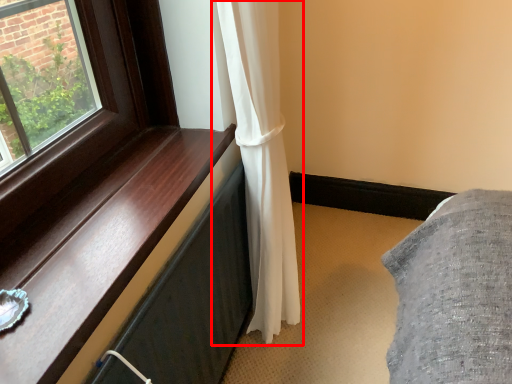
Question: From the image's perspective, what is the correct spatial positioning of curtain (annotated by the red box) in reference to window sill?

Choices:
 (A) below
 (B) above

Answer: (B)